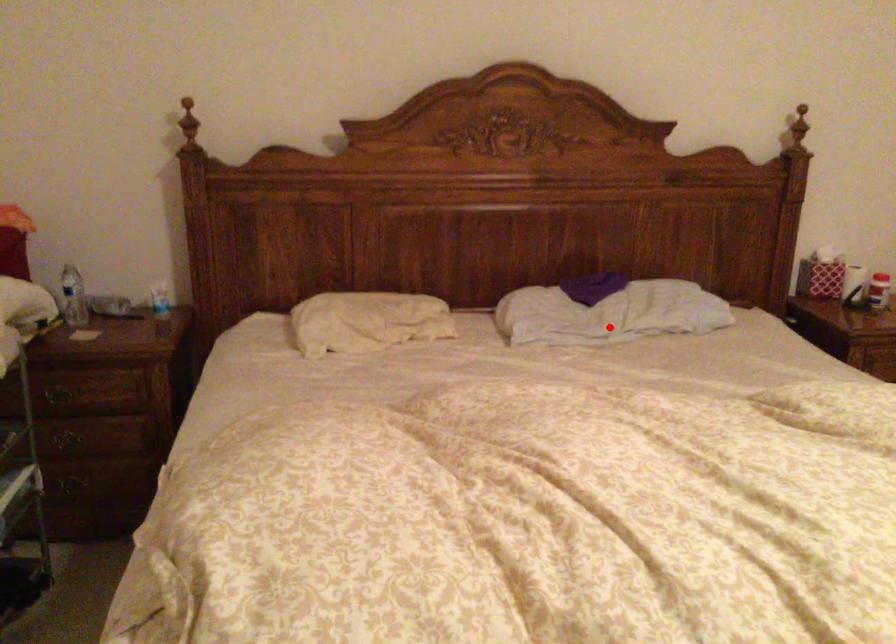
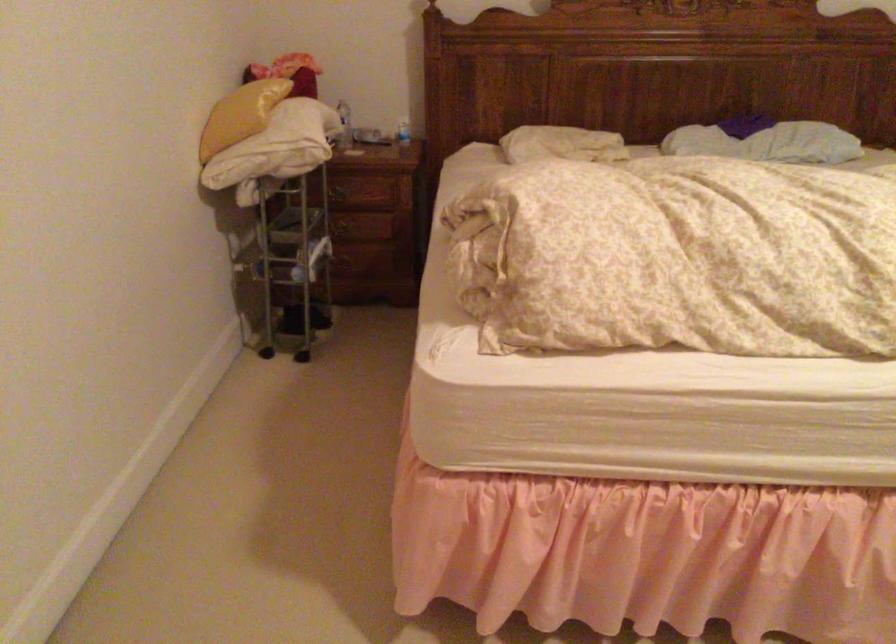
Question: A red point is marked in image1. In image2, is the corresponding 3D point closer to the camera or farther? Reply with the corresponding letter.

Choices:
 (A) The corresponding 3D point is closer.
 (B) The corresponding 3D point is farther.

Answer: (B)